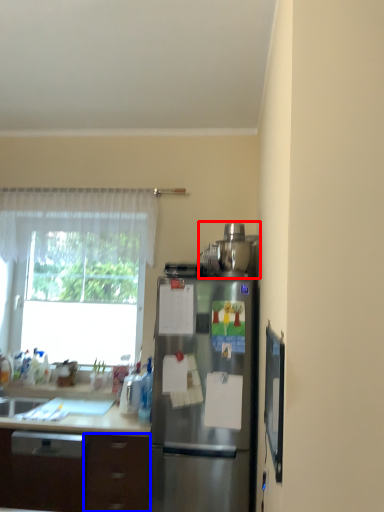
Question: Which object appears farthest to the camera in this image, appliance (highlighted by a red box) or drawer (highlighted by a blue box)?

Choices:
 (A) appliance
 (B) drawer

Answer: (A)